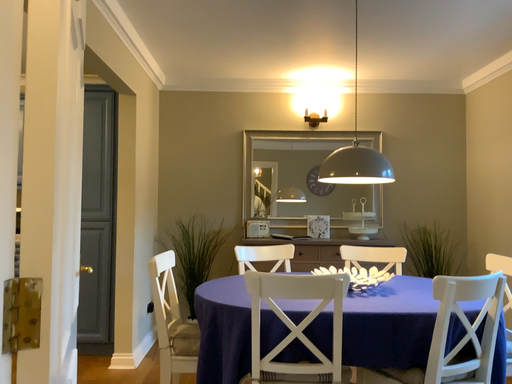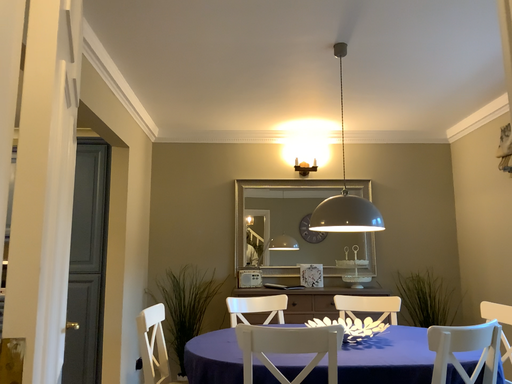
Question: Which way did the camera rotate in the video?

Choices:
 (A) rotated downward
 (B) rotated upward

Answer: (B)